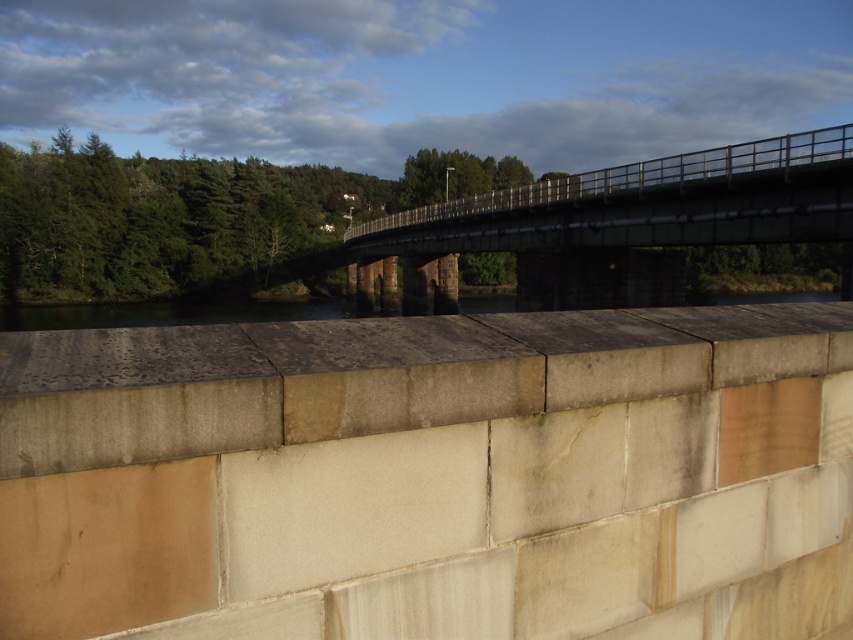
Question: Observing the image, what is the correct spatial positioning of smooth concrete ledge at center in reference to green metal pedestrian bridge at center?

Choices:
 (A) below
 (B) above

Answer: (A)

Question: Which object appears closest to the camera in this image?

Choices:
 (A) smooth concrete ledge at center
 (B) green metal pedestrian bridge at center

Answer: (A)

Question: Is smooth concrete ledge at center further to the viewer compared to green metal pedestrian bridge at center?

Choices:
 (A) yes
 (B) no

Answer: (B)

Question: Is smooth concrete ledge at center positioned behind green metal pedestrian bridge at center?

Choices:
 (A) yes
 (B) no

Answer: (B)